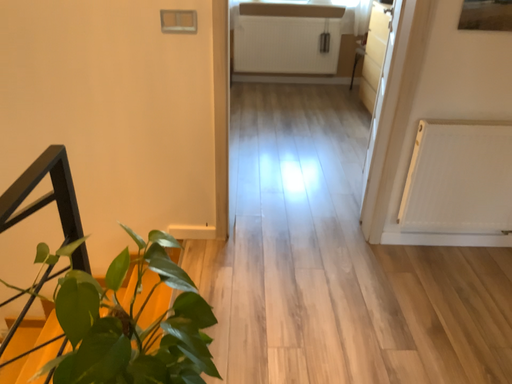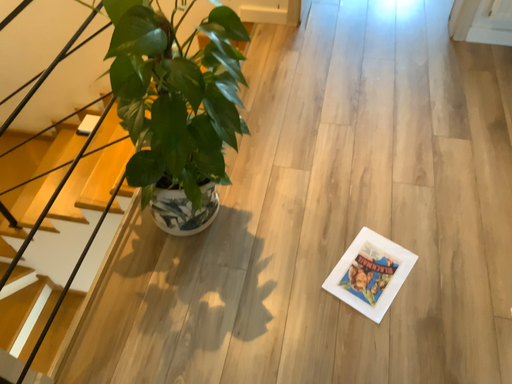
Question: How did the camera likely rotate when shooting the video?

Choices:
 (A) rotated upward
 (B) rotated downward

Answer: (B)